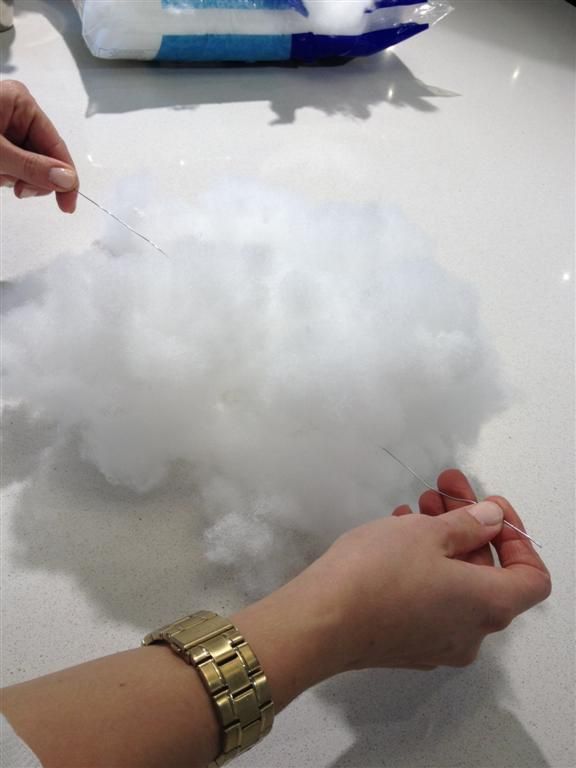
Identify the location of empty white desk. This screenshot has height=768, width=576. (488, 161).